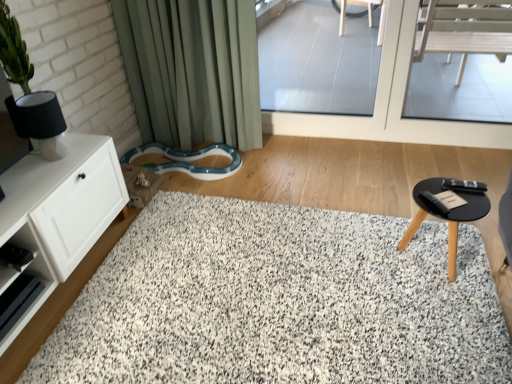
Identify the location of vacant region to the left of black matte table at lower right. (368, 267).